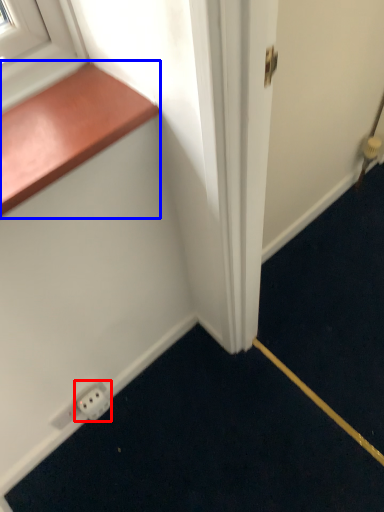
Question: Which object is closer to the camera taking this photo, electric outlet (highlighted by a red box) or window sill (highlighted by a blue box)?

Choices:
 (A) electric outlet
 (B) window sill

Answer: (B)